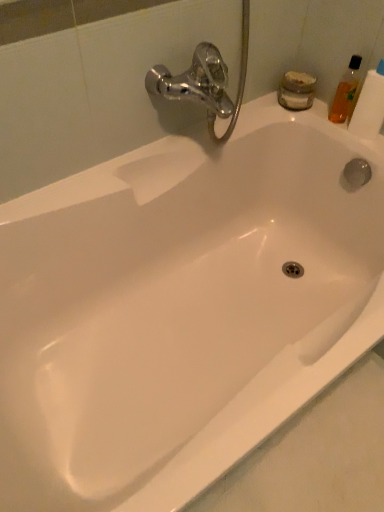
Image resolution: width=384 pixels, height=512 pixels. What do you see at coordinates (369, 108) in the screenshot? I see `translucent plastic toilet paper at upper right` at bounding box center [369, 108].

Locate an element on the screen. The height and width of the screenshot is (512, 384). translucent plastic toilet paper at upper right is located at coordinates (369, 108).

This screenshot has width=384, height=512. What do you see at coordinates (345, 92) in the screenshot?
I see `translucent orange bottle at upper right` at bounding box center [345, 92].

Where is `translucent orange bottle at upper right`? The width and height of the screenshot is (384, 512). translucent orange bottle at upper right is located at coordinates (345, 92).

The width and height of the screenshot is (384, 512). Find the location of `translucent plastic toilet paper at upper right`. translucent plastic toilet paper at upper right is located at coordinates (369, 108).

Which is more to the right, translucent orange bottle at upper right or translucent plastic toilet paper at upper right?

translucent plastic toilet paper at upper right is more to the right.

Is translucent orange bottle at upper right in front of or behind translucent plastic toilet paper at upper right in the image?

Clearly, translucent orange bottle at upper right is behind translucent plastic toilet paper at upper right.

Does point (348, 67) come farther from viewer compared to point (382, 119)?

Yes, point (348, 67) is behind point (382, 119).

From the image's perspective, is translucent orange bottle at upper right above or below translucent plastic toilet paper at upper right?

translucent orange bottle at upper right is situated higher than translucent plastic toilet paper at upper right in the image.

From a real-world perspective, which is physically below, translucent orange bottle at upper right or translucent plastic toilet paper at upper right?

translucent orange bottle at upper right is physically lower.

Which of these two, translucent orange bottle at upper right or translucent plastic toilet paper at upper right, is wider?

translucent plastic toilet paper at upper right.

Between translucent orange bottle at upper right and translucent plastic toilet paper at upper right, which one has less height?

translucent orange bottle at upper right is shorter.

From the picture: Between translucent orange bottle at upper right and translucent plastic toilet paper at upper right, which one has larger size?

translucent plastic toilet paper at upper right.

Is translucent orange bottle at upper right inside or outside of translucent plastic toilet paper at upper right?

The correct answer is: outside.

Is translucent orange bottle at upper right not close to translucent plastic toilet paper at upper right?

No.

Does translucent orange bottle at upper right turn towards translucent plastic toilet paper at upper right?

No, translucent orange bottle at upper right is not facing towards translucent plastic toilet paper at upper right.

How different are the orientations of translucent orange bottle at upper right and translucent plastic toilet paper at upper right in degrees?

The angular difference between translucent orange bottle at upper right and translucent plastic toilet paper at upper right is 6.59e-05 degrees.

How far apart are translucent orange bottle at upper right and translucent plastic toilet paper at upper right?

2.85 inches.

Find the location of a particular element. This screenshot has height=512, width=384. toiletry located above the translucent plastic toilet paper at upper right (from the image's perspective) is located at coordinates (345, 92).

Is translucent plastic toilet paper at upper right at the left side of translucent orange bottle at upper right?

Incorrect, translucent plastic toilet paper at upper right is not on the left side of translucent orange bottle at upper right.

Relative to translucent orange bottle at upper right, is translucent plastic toilet paper at upper right in front or behind?

Clearly, translucent plastic toilet paper at upper right is in front of translucent orange bottle at upper right.

Considering the positions of points (369, 115) and (353, 84), is point (369, 115) farther from camera compared to point (353, 84)?

That is False.

From the image's perspective, between translucent plastic toilet paper at upper right and translucent orange bottle at upper right, who is located below?

translucent plastic toilet paper at upper right is shown below in the image.

From a real-world perspective, between translucent plastic toilet paper at upper right and translucent orange bottle at upper right, who is vertically lower?

translucent orange bottle at upper right is physically lower.

Is translucent plastic toilet paper at upper right thinner than translucent orange bottle at upper right?

No, translucent plastic toilet paper at upper right is not thinner than translucent orange bottle at upper right.

Between translucent plastic toilet paper at upper right and translucent orange bottle at upper right, which one has more height?

Standing taller between the two is translucent plastic toilet paper at upper right.

Who is smaller, translucent plastic toilet paper at upper right or translucent orange bottle at upper right?

Smaller between the two is translucent orange bottle at upper right.

Is translucent plastic toilet paper at upper right completely or partially outside of translucent orange bottle at upper right?

translucent plastic toilet paper at upper right is positioned outside translucent orange bottle at upper right.

Are translucent plastic toilet paper at upper right and translucent orange bottle at upper right far apart?

They are positioned close to each other.

Is translucent orange bottle at upper right at the back of translucent plastic toilet paper at upper right?

No.

Locate an element on the screen. toilet paper above the translucent orange bottle at upper right (from a real-world perspective) is located at coordinates (369, 108).

The image size is (384, 512). Find the location of `toilet paper below the translucent orange bottle at upper right (from the image's perspective)`. toilet paper below the translucent orange bottle at upper right (from the image's perspective) is located at coordinates (369, 108).

This screenshot has height=512, width=384. I want to click on toiletry behind the translucent plastic toilet paper at upper right, so click(345, 92).